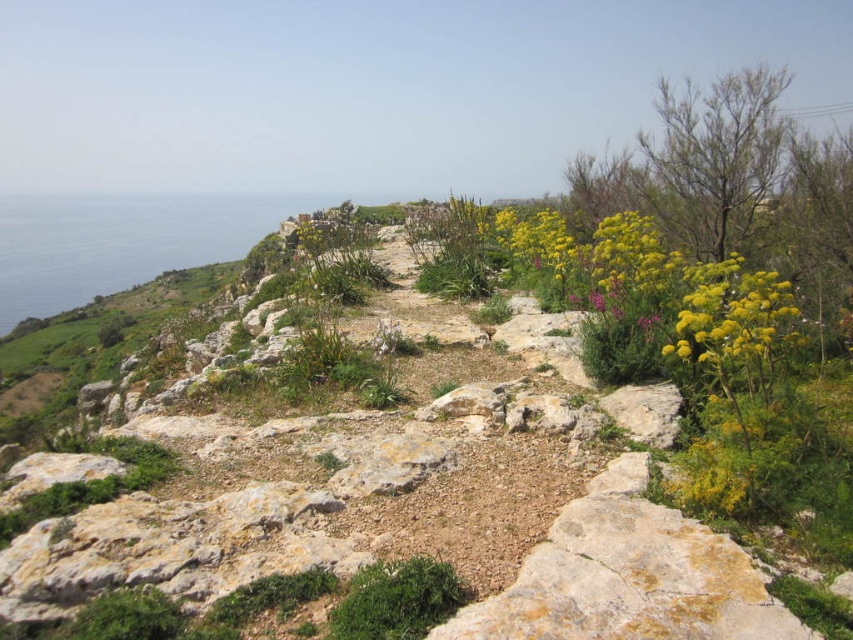
Question: Is blue water at left smaller than green leafy bush at lower center?

Choices:
 (A) yes
 (B) no

Answer: (B)

Question: Which is nearer to the yellow fluffy plant at right?

Choices:
 (A) yellow fluffy plant at upper right
 (B) blue water at left

Answer: (A)

Question: Which object is the farthest from the yellow fluffy plant at right?

Choices:
 (A) blue water at left
 (B) yellow fluffy plant at upper right
 (C) green leafy bush at lower center

Answer: (A)

Question: Which object appears farthest from the camera in this image?

Choices:
 (A) blue water at left
 (B) yellow fluffy plant at right
 (C) green leafy bush at lower center

Answer: (A)

Question: Is yellow fluffy plant at right wider than yellow fluffy plant at upper right?

Choices:
 (A) yes
 (B) no

Answer: (A)

Question: Observing the image, what is the correct spatial positioning of yellow fluffy plant at right in reference to yellow fluffy plant at upper right?

Choices:
 (A) above
 (B) below

Answer: (A)